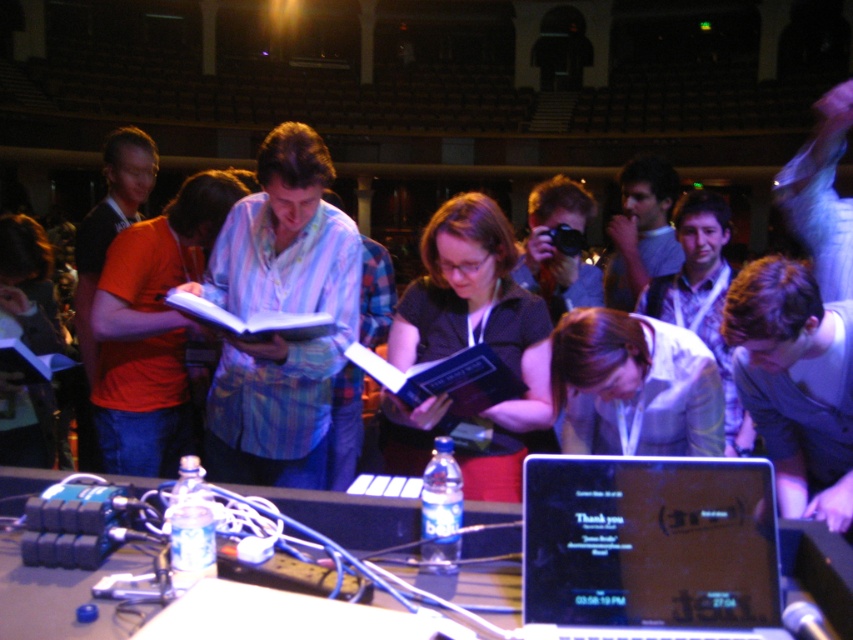
You are an event organizer who needs to place a name tag on the table. The name tag is 10 cm wide. There is a clear plastic water bottle at center and a blue hardcover book at center. Can you fit the name tag between them?

The clear plastic water bottle at center is to the left of blue hardcover book at center. Since the name tag is 10 cm wide, you need to check the space between them. However, the exact distance isn

You are standing at the entrance of the hall and want to locate the clear plastic water bottle at center on the table. Based on the coordinates provided, can you determine its exact location relative to the table?

The clear plastic water bottle at center is located at coordinates point (x=346, y=515) on the table.